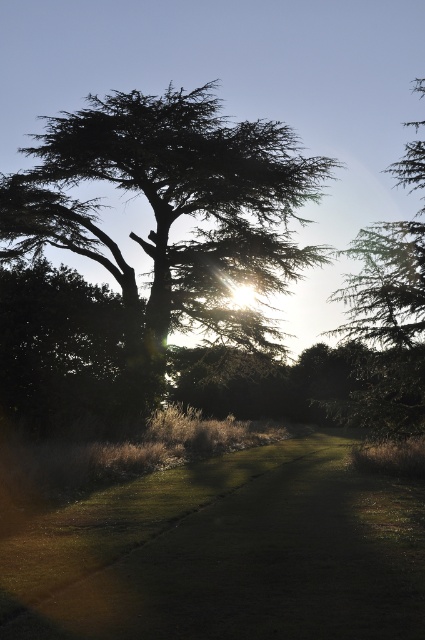
Which is more to the right, green leafy tree at center or green textured tree at upper right?

Positioned to the right is green textured tree at upper right.

Is point (210, 232) farther from camera compared to point (410, 410)?

Yes, it is behind point (410, 410).

Locate an element on the screen. The height and width of the screenshot is (640, 425). green leafy tree at center is located at coordinates (173, 214).

This screenshot has height=640, width=425. What do you see at coordinates (226, 554) in the screenshot? I see `green grass at center` at bounding box center [226, 554].

Is green grass at center smaller than green textured tree at upper right?

Indeed, green grass at center has a smaller size compared to green textured tree at upper right.

Does point (203, 522) come closer to viewer compared to point (365, 371)?

Yes, point (203, 522) is in front of point (365, 371).

Locate an element on the screen. The width and height of the screenshot is (425, 640). green grass at center is located at coordinates (226, 554).

Is green grass at center bigger than green leafy tree at center?

No, green grass at center is not bigger than green leafy tree at center.

Does green grass at center have a greater width compared to green leafy tree at center?

In fact, green grass at center might be narrower than green leafy tree at center.

Which is in front, point (76, 596) or point (90, 170)?

Point (76, 596) is more forward.

Where is `green grass at center`? green grass at center is located at coordinates (226, 554).